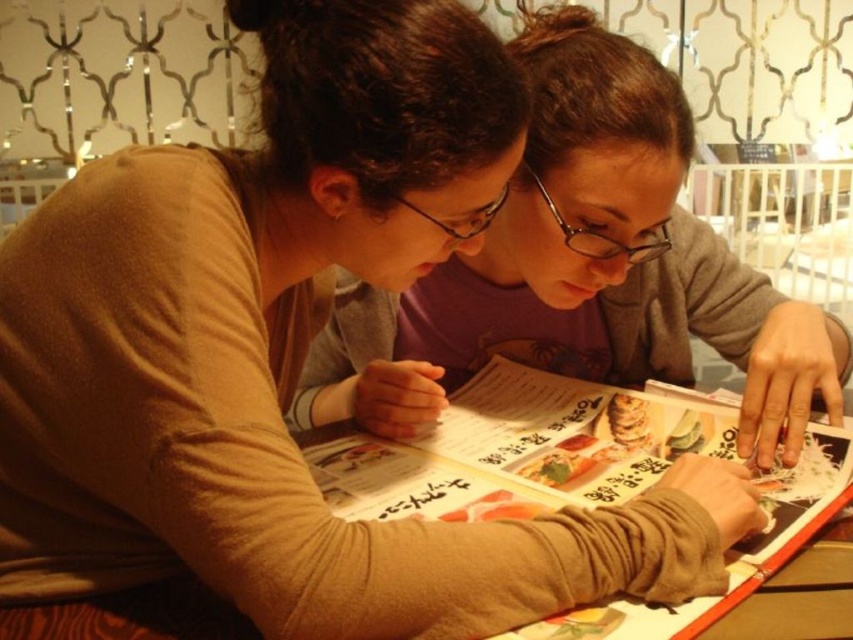
Between matte gray sweater at center and printed paper menu at center, which one is positioned higher?

Positioned higher is matte gray sweater at center.

How much distance is there between matte gray sweater at center and printed paper menu at center?

They are 5.36 inches apart.

What do you see at coordinates (583, 269) in the screenshot? This screenshot has width=853, height=640. I see `matte gray sweater at center` at bounding box center [583, 269].

The width and height of the screenshot is (853, 640). Identify the location of matte gray sweater at center. (583, 269).